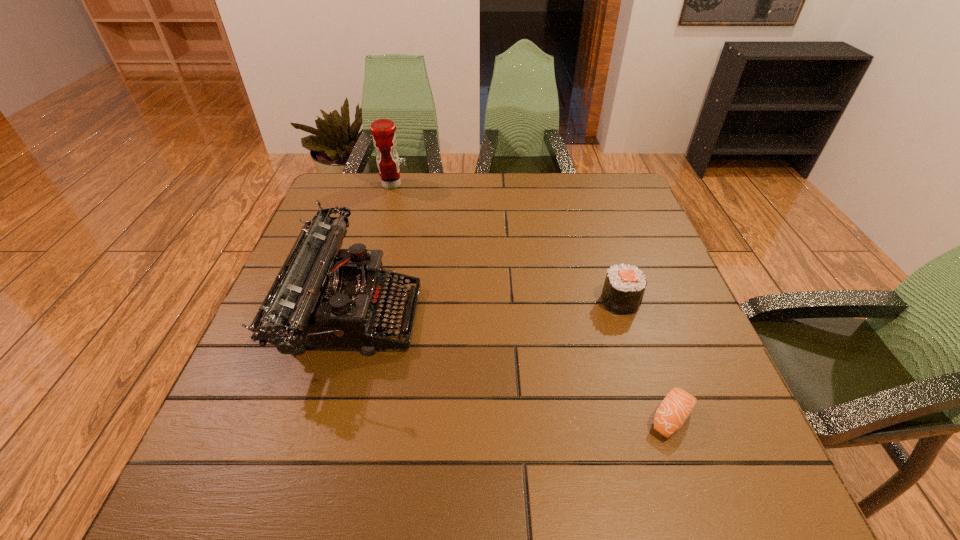
Find the location of a particular element. vacant space at the far right corner is located at coordinates (617, 206).

Find the location of `free space between the third shortest object and the farthest object`. free space between the third shortest object and the farthest object is located at coordinates point(373,249).

Locate an element on the screen. Image resolution: width=960 pixels, height=540 pixels. empty location between the second shortest object and the second tallest object is located at coordinates (487, 307).

Identify the location of free space between the farthest object and the farther sushi. (506, 243).

This screenshot has width=960, height=540. Identify the location of free space between the farthest object and the second tallest object. (373, 249).

The image size is (960, 540). Identify the location of unoccupied position between the third tallest object and the shortest object. (646, 360).

Where is `free space between the farther sushi and the nearer sushi`? This screenshot has height=540, width=960. free space between the farther sushi and the nearer sushi is located at coordinates (646, 360).

Where is `free spot between the farther sushi and the farthest object`? free spot between the farther sushi and the farthest object is located at coordinates (506, 243).

This screenshot has height=540, width=960. What are the coordinates of `vacant area between the typewriter and the second shortest object` in the screenshot? It's located at (487, 307).

Identify the location of free spot between the farthest object and the taller sushi. (506, 243).